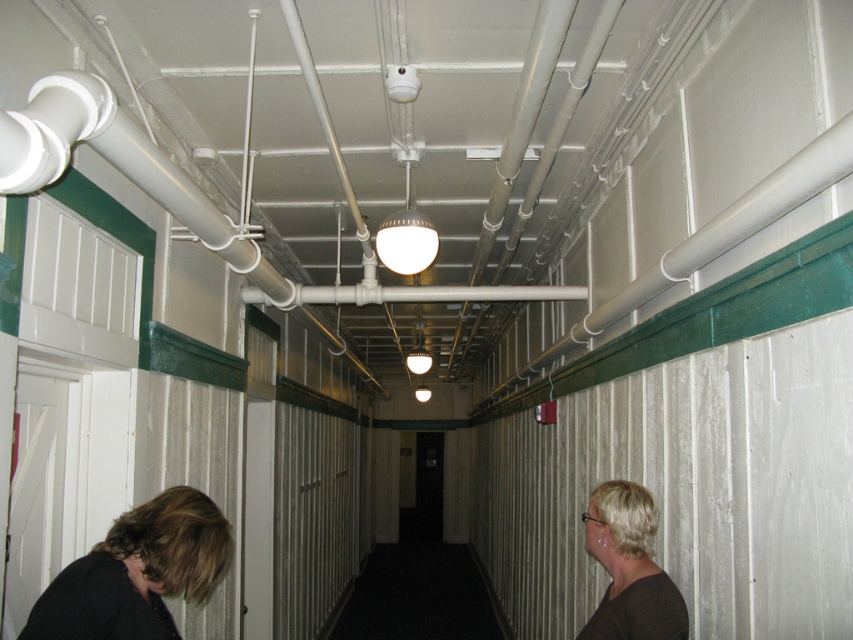
Question: Which object is positioned farthest from the blonde hair at right?

Choices:
 (A) dark brown hair at lower left
 (B) black carpet at center

Answer: (B)

Question: Among these objects, which one is nearest to the camera?

Choices:
 (A) white matte pipe at upper center
 (B) dark brown hair at lower left

Answer: (A)

Question: Among these objects, which one is farthest from the camera?

Choices:
 (A) white matte pipe at upper center
 (B) dark brown hair at lower left
 (C) blonde hair at right

Answer: (C)

Question: Observing the image, what is the correct spatial positioning of dark brown hair at lower left in reference to blonde hair at right?

Choices:
 (A) above
 (B) below

Answer: (A)

Question: Is dark brown hair at lower left closer to camera compared to black carpet at center?

Choices:
 (A) no
 (B) yes

Answer: (B)

Question: Does dark brown hair at lower left have a larger size compared to blonde hair at right?

Choices:
 (A) yes
 (B) no

Answer: (B)